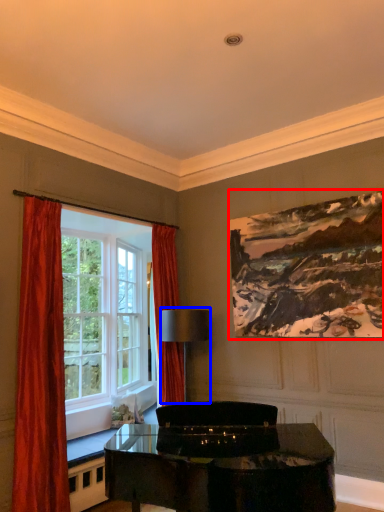
Question: Which of the following is the farthest to the observer, picture frame (highlighted by a red box) or lamp (highlighted by a blue box)?

Choices:
 (A) picture frame
 (B) lamp

Answer: (B)